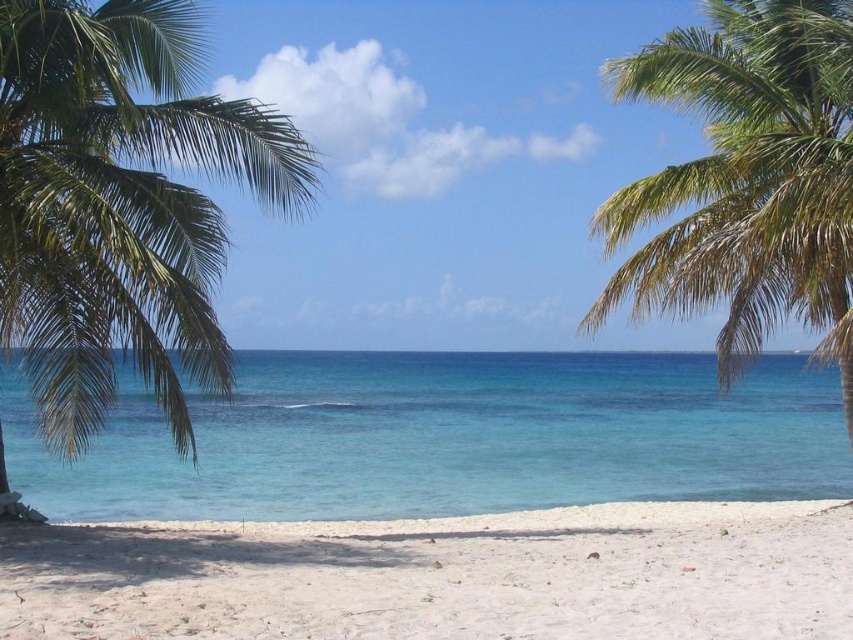
You are standing on the beach and want to take a photo of the green leafy palm tree at right without including the white sandy beach at lower center in the frame. Which direction should you face?

You should face to the right of the green leafy palm tree at right because the white sandy beach at lower center is located to its left side, so turning right would position the beach out of the camera frame.

You are standing on the beach and want to reach the clear blue water at center. According to the coordinates provided, in which direction should you walk from your current position to reach the water?

The clear blue water at center is located at coordinates point (445, 436). Since the x and y coordinates are both greater than 0.5, you should walk northeast to reach the water.